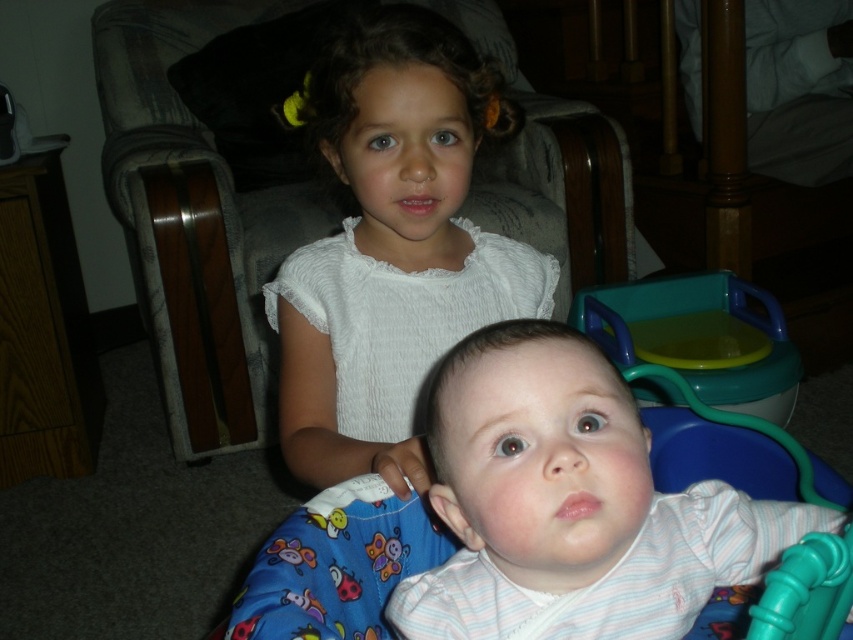
Describe the element at coordinates (570, 504) in the screenshot. Image resolution: width=853 pixels, height=640 pixels. I see `white striped shirt at center` at that location.

How much distance is there between white striped shirt at center and white lace dress at upper center?

A distance of 11.15 inches exists between white striped shirt at center and white lace dress at upper center.

Does point (494, 449) come closer to viewer compared to point (466, 280)?

Yes, it is in front of point (466, 280).

Where is `white striped shirt at center`? The width and height of the screenshot is (853, 640). white striped shirt at center is located at coordinates (570, 504).

Is white striped shirt at center thinner than teal plastic potty at lower right?

Correct, white striped shirt at center's width is less than teal plastic potty at lower right's.

Which is behind, point (587, 509) or point (733, 378)?

The point (733, 378) is more distant.

Where is `white striped shirt at center`? Image resolution: width=853 pixels, height=640 pixels. white striped shirt at center is located at coordinates (570, 504).

Does white lace dress at upper center have a greater height compared to teal plastic potty at lower right?

Yes, white lace dress at upper center is taller than teal plastic potty at lower right.

Does point (390, 282) lie in front of point (606, 353)?

That is False.

Which is behind, point (288, 378) or point (769, 296)?

Positioned behind is point (769, 296).

I want to click on white lace dress at upper center, so click(393, 248).